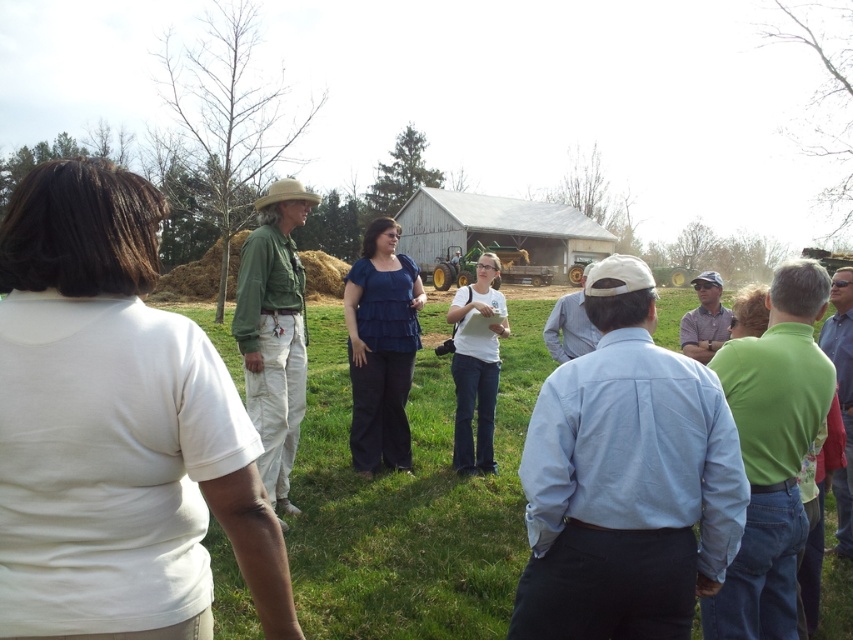
You are part of the group in the image and want to know who is taller between the green cotton shirt at center and the white cotton shirt at center. Based on the scene, can you determine which one is taller?

The green cotton shirt at center is taller than the white cotton shirt at center.

You are standing at the point marked as point (274,332) in the image. What object are you currently standing on?

The point (274,332) is on the green cotton shirt at center.